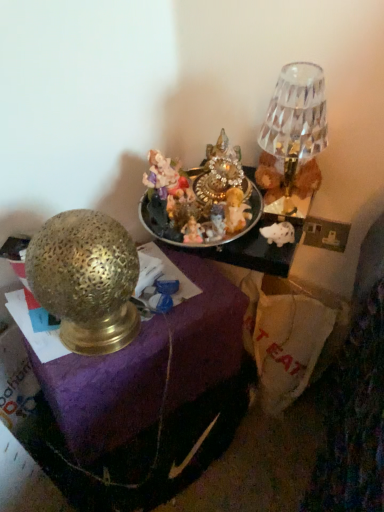
Question: From their relative heights in the image, would you say crystal glass lampshade at upper right, arranged as the second lamp when viewed from the left, is taller or shorter than gold textured lamp at left?

Choices:
 (A) short
 (B) tall

Answer: (A)

Question: Does point (286, 106) appear closer or farther from the camera than point (185, 439)?

Choices:
 (A) farther
 (B) closer

Answer: (B)

Question: Which of these objects is positioned farthest from the gold textured lamp at left, the 2th lamp viewed from the top?

Choices:
 (A) gold textured lamp at left
 (B) crystal glass lampshade at upper right, arranged as the second lamp when viewed from the left
 (C) shiny metallic tray at center

Answer: (B)

Question: Which is farther from the shiny metallic tray at center?

Choices:
 (A) crystal glass lampshade at upper right, arranged as the second lamp when viewed from the left
 (B) gold textured lamp at left
 (C) gold textured lamp at left, acting as the first lamp starting from the left

Answer: (B)